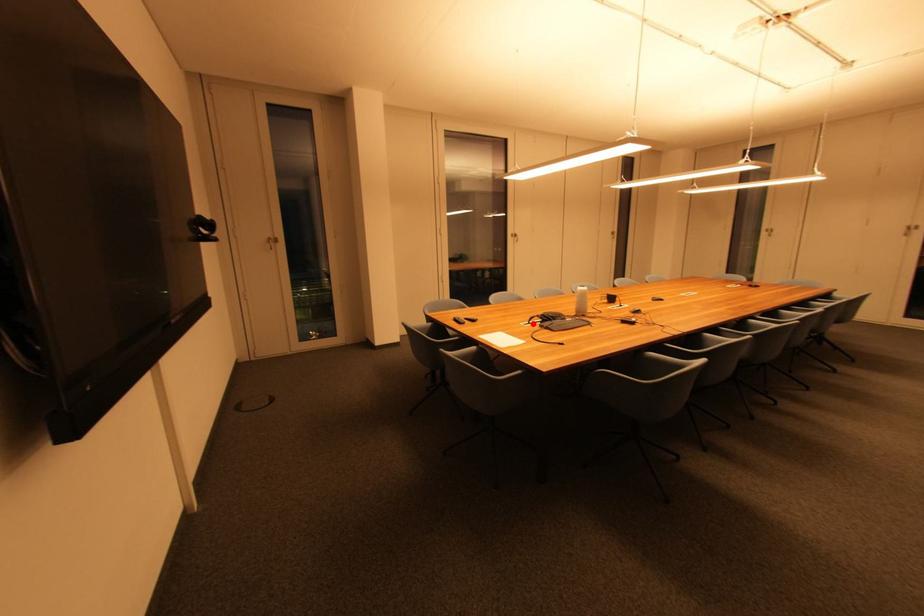
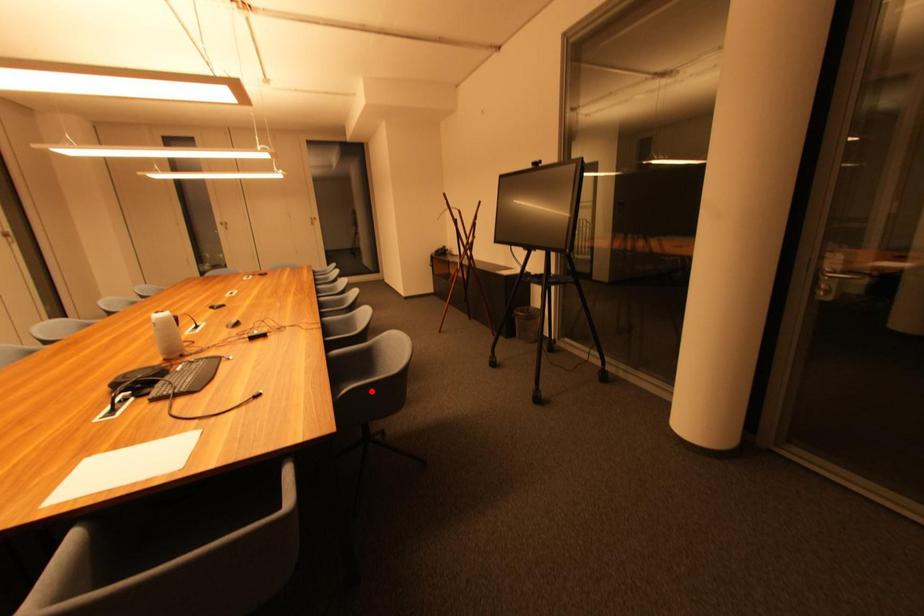
I am providing you with two images of the same scene from different viewpoints. A red point is marked on the first image and another point is marked on the second image. Does the point marked in image1 correspond to the same location as the one in image2?

No